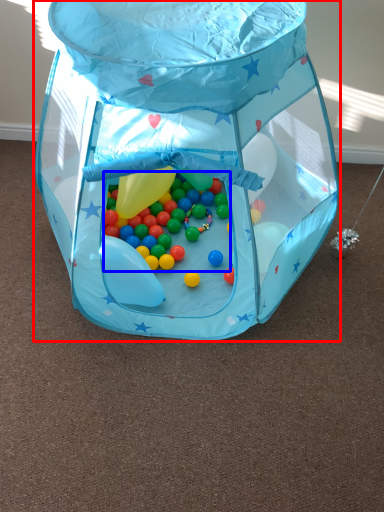
Question: Which object appears closest to the camera in this image, toy (highlighted by a red box) or candy (highlighted by a blue box)?

Choices:
 (A) toy
 (B) candy

Answer: (A)